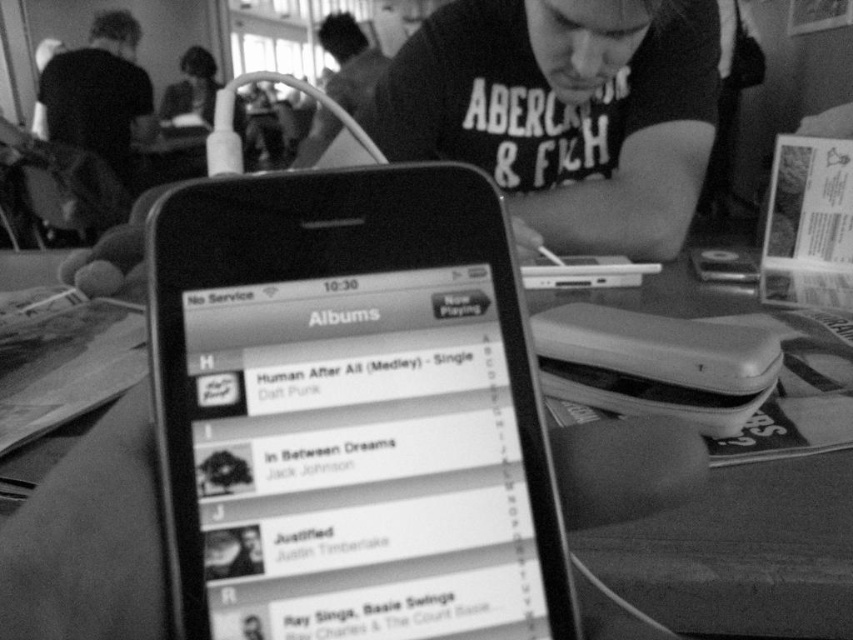
Question: Which of the following is the closest to the observer?

Choices:
 (A) metallic silver laptop at center
 (B) smooth plastic phone at center
 (C) smooth glossy phone at center
 (D) smooth black phone at center

Answer: (C)

Question: Which of the following is the closest to the observer?

Choices:
 (A) smooth glossy phone at center
 (B) smooth black phone at center
 (C) black fabric backpack at upper left
 (D) smooth plastic phone at center

Answer: (A)

Question: Observing the image, what is the correct spatial positioning of smooth glossy phone at center in reference to black fabric backpack at upper left?

Choices:
 (A) left
 (B) right

Answer: (B)

Question: Is smooth glossy phone at center further to the viewer compared to black fabric backpack at upper left?

Choices:
 (A) no
 (B) yes

Answer: (A)

Question: Estimate the real-world distances between objects in this image. Which object is farther from the metallic silver laptop at center?

Choices:
 (A) smooth glossy phone at center
 (B) black fabric backpack at upper left
 (C) smooth plastic phone at center

Answer: (B)

Question: Is smooth glossy phone at center to the right of smooth plastic phone at center from the viewer's perspective?

Choices:
 (A) yes
 (B) no

Answer: (B)